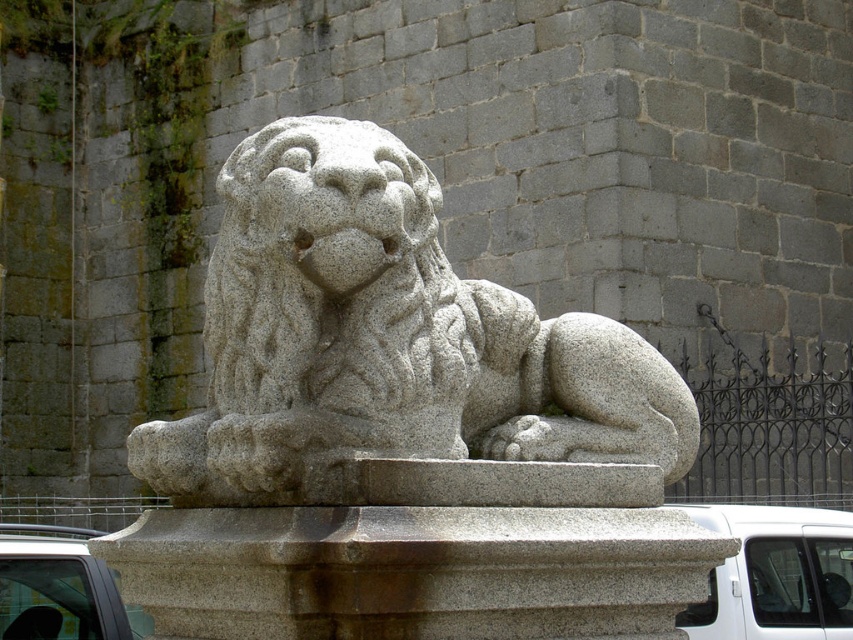
Question: Which is nearer to the white matte car at lower left?

Choices:
 (A) granite lion at center
 (B) granite pedestal at center

Answer: (A)

Question: Can you confirm if granite lion at center is smaller than granite pedestal at center?

Choices:
 (A) no
 (B) yes

Answer: (A)

Question: Can you confirm if granite pedestal at center is smaller than white matte car at lower left?

Choices:
 (A) yes
 (B) no

Answer: (A)

Question: Which point is closer to the camera?

Choices:
 (A) granite lion at center
 (B) white matte van at lower right

Answer: (A)

Question: Which object appears farthest from the camera in this image?

Choices:
 (A) white matte car at lower left
 (B) white matte van at lower right
 (C) granite lion at center
 (D) granite pedestal at center

Answer: (B)

Question: Can you confirm if granite pedestal at center is smaller than white matte van at lower right?

Choices:
 (A) yes
 (B) no

Answer: (B)